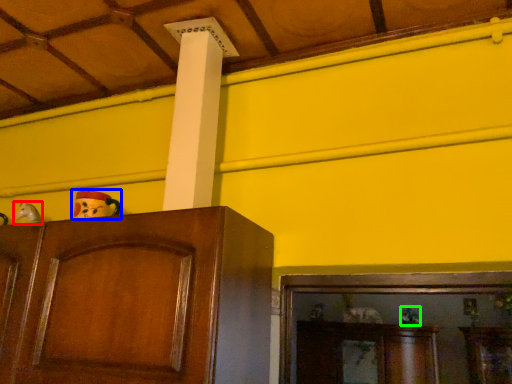
Question: Which object is positioned closest to toy (highlighted by a red box)? Select from toy (highlighted by a blue box) and toy (highlighted by a green box).

Choices:
 (A) toy
 (B) toy

Answer: (A)